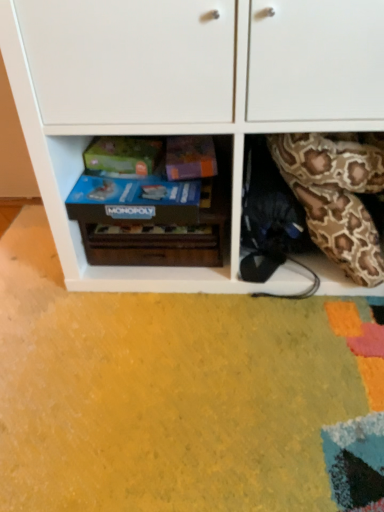
What do you see at coordinates (209, 210) in the screenshot? The width and height of the screenshot is (384, 512). I see `wooden monopoly game at center` at bounding box center [209, 210].

What is the approximate width of brown patterned fabric at right?

brown patterned fabric at right is 7.78 inches in width.

Identify the location of white matte cabinet at center. (183, 96).

From a real-world perspective, is wooden monopoly game at center above or below blue cardboard monopoly game at center?

Clearly, from a real-world perspective, wooden monopoly game at center is below blue cardboard monopoly game at center.

Is wooden monopoly game at center inside the boundaries of blue cardboard monopoly game at center, or outside?

wooden monopoly game at center is located beyond the bounds of blue cardboard monopoly game at center.

Is wooden monopoly game at center behind blue cardboard monopoly game at center?

That is True.

Which object is positioned more to the right, wooden monopoly game at center or blue cardboard monopoly game at center?

From the viewer's perspective, wooden monopoly game at center appears more on the right side.

From the image's perspective, is wooden monopoly game at center located above or below brown patterned fabric at right?

wooden monopoly game at center is situated higher than brown patterned fabric at right in the image.

Is wooden monopoly game at center smaller than brown patterned fabric at right?

No, wooden monopoly game at center is not smaller than brown patterned fabric at right.

From a real-world perspective, is wooden monopoly game at center below brown patterned fabric at right?

Yes.

Where is `snake below the wooden monopoly game at center (from the image's perspective)`? snake below the wooden monopoly game at center (from the image's perspective) is located at coordinates (335, 197).

Is brown patterned fabric at right inside blue cardboard monopoly game at center?

No.

Is the position of blue cardboard monopoly game at center less distant than that of brown patterned fabric at right?

No, it is behind brown patterned fabric at right.

Are blue cardboard monopoly game at center and brown patterned fabric at right beside each other?

blue cardboard monopoly game at center and brown patterned fabric at right are clearly separated.

Is brown patterned fabric at right bigger or smaller than wooden monopoly game at center?

In the image, brown patterned fabric at right appears to be smaller than wooden monopoly game at center.

Is brown patterned fabric at right not near wooden monopoly game at center?

No, brown patterned fabric at right is in close proximity to wooden monopoly game at center.

Is blue cardboard monopoly game at center positioned in front of wooden monopoly game at center?

Yes, the depth of blue cardboard monopoly game at center is less than that of wooden monopoly game at center.

Is blue cardboard monopoly game at center not close to wooden monopoly game at center?

No, blue cardboard monopoly game at center is not far from wooden monopoly game at center.

From their relative heights in the image, would you say blue cardboard monopoly game at center is taller or shorter than wooden monopoly game at center?

blue cardboard monopoly game at center is shorter than wooden monopoly game at center.

Based on their positions, is white matte cabinet at center located to the left or right of brown patterned fabric at right?

From the image, it's evident that white matte cabinet at center is to the left of brown patterned fabric at right.

Does white matte cabinet at center have a smaller size compared to brown patterned fabric at right?

Actually, white matte cabinet at center might be larger than brown patterned fabric at right.

Identify the location of cabinetry lying on the left of brown patterned fabric at right. Image resolution: width=384 pixels, height=512 pixels. (183, 96).

Considering the sizes of objects white matte cabinet at center and brown patterned fabric at right in the image provided, who is taller, white matte cabinet at center or brown patterned fabric at right?

Standing taller between the two is white matte cabinet at center.

Is white matte cabinet at center surrounding wooden monopoly game at center?

Yes, white matte cabinet at center contains wooden monopoly game at center.

From a real-world perspective, who is located lower, white matte cabinet at center or wooden monopoly game at center?

wooden monopoly game at center.

At what (x,y) coordinates should I click in order to perform the action: click on shelf below the white matte cabinet at center (from the image's perspective). Please return your answer as a coordinate pair (x, y). Looking at the image, I should click on [x=209, y=210].

I want to click on shelf below the blue cardboard monopoly game at center (from the image's perspective), so click(x=209, y=210).

Locate an element on the screen. shelf lying behind the brown patterned fabric at right is located at coordinates (209, 210).

Considering their positions, is white matte cabinet at center positioned closer to wooden monopoly game at center than brown patterned fabric at right?

The object closer to wooden monopoly game at center is white matte cabinet at center.

Which object lies further to the anchor point white matte cabinet at center, wooden monopoly game at center or brown patterned fabric at right?

brown patterned fabric at right lies further to white matte cabinet at center than the other object.

From the image, which object appears to be nearer to white matte cabinet at center, wooden monopoly game at center or blue cardboard monopoly game at center?

Based on the image, wooden monopoly game at center appears to be nearer to white matte cabinet at center.

From the image, which object appears to be nearer to blue cardboard monopoly game at center, white matte cabinet at center or wooden monopoly game at center?

The object closer to blue cardboard monopoly game at center is wooden monopoly game at center.

Estimate the real-world distances between objects in this image. Which object is closer to brown patterned fabric at right, blue cardboard monopoly game at center or white matte cabinet at center?

white matte cabinet at center is positioned closer to the anchor brown patterned fabric at right.

Looking at the image, which one is located further to blue cardboard monopoly game at center, white matte cabinet at center or brown patterned fabric at right?

The object further to blue cardboard monopoly game at center is brown patterned fabric at right.

Estimate the real-world distances between objects in this image. Which object is closer to blue cardboard monopoly game at center, wooden monopoly game at center or brown patterned fabric at right?

Based on the image, wooden monopoly game at center appears to be nearer to blue cardboard monopoly game at center.

From the image, which object appears to be nearer to white matte cabinet at center, blue cardboard monopoly game at center or wooden monopoly game at center?

Among the two, wooden monopoly game at center is located nearer to white matte cabinet at center.

What are the coordinates of `shoe box between white matte cabinet at center and wooden monopoly game at center along the z-axis` in the screenshot? It's located at (134, 201).

What are the coordinates of `cabinetry between wooden monopoly game at center and brown patterned fabric at right from left to right` in the screenshot? It's located at (183, 96).

Locate an element on the screen. cabinetry between blue cardboard monopoly game at center and brown patterned fabric at right is located at coordinates (183, 96).

Where is `shelf between blue cardboard monopoly game at center and brown patterned fabric at right`? The height and width of the screenshot is (512, 384). shelf between blue cardboard monopoly game at center and brown patterned fabric at right is located at coordinates (209, 210).